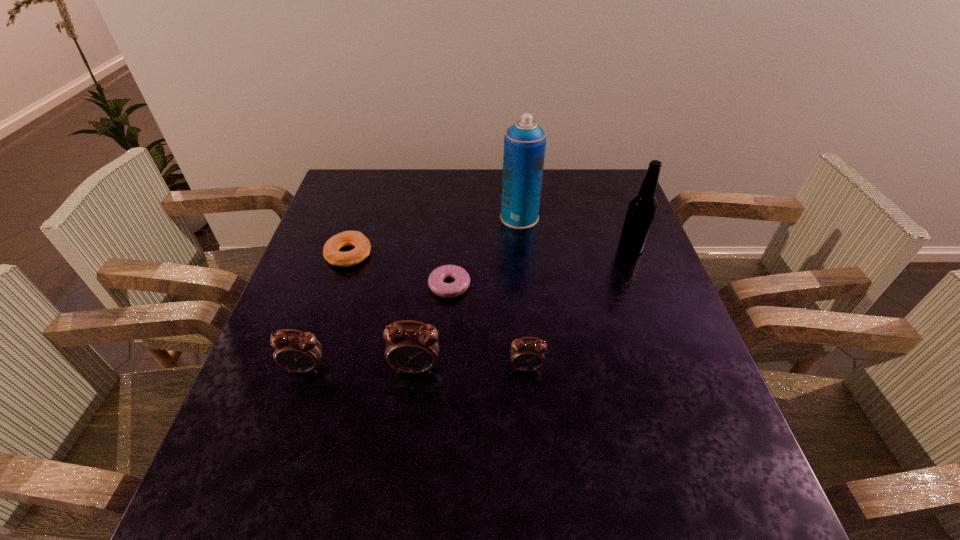
Select which alarm clock is the third closest to the sixth tallest object. Please provide its 2D coordinates. Your answer should be formatted as a tuple, i.e. [(x, y)], where the tuple contains the x and y coordinates of a point satisfying the conditions above.

[(525, 355)]

The image size is (960, 540). Find the location of `alarm clock that is the closest to the second shortest object`. alarm clock that is the closest to the second shortest object is located at coordinates (301, 352).

Where is `free space that satisfies the following two spatial constraints: 1. on the back side of the farthest object; 2. on the right side of the fourth farthest object`? free space that satisfies the following two spatial constraints: 1. on the back side of the farthest object; 2. on the right side of the fourth farthest object is located at coordinates (454, 218).